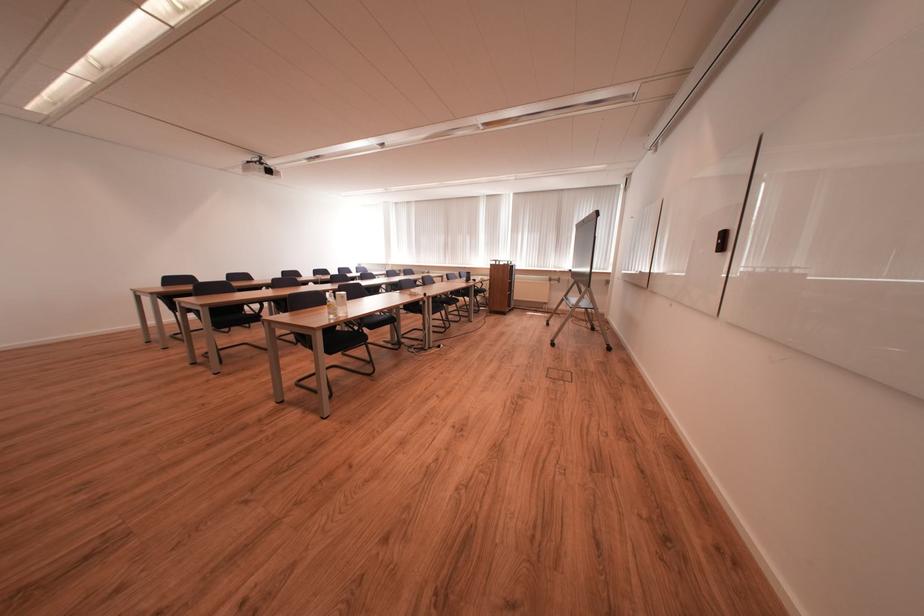
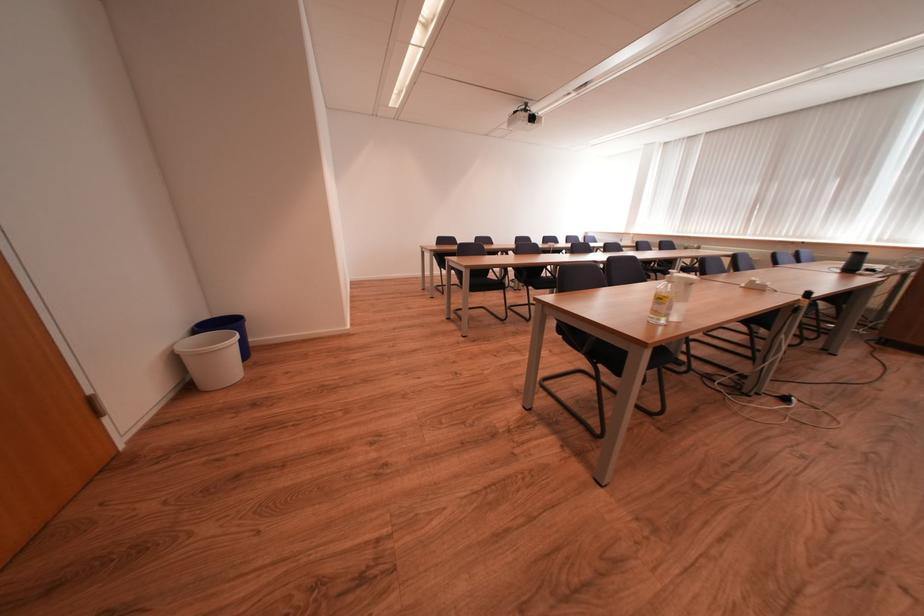
Find the pixel in the second image that matches [344,310] in the first image.

(678, 310)